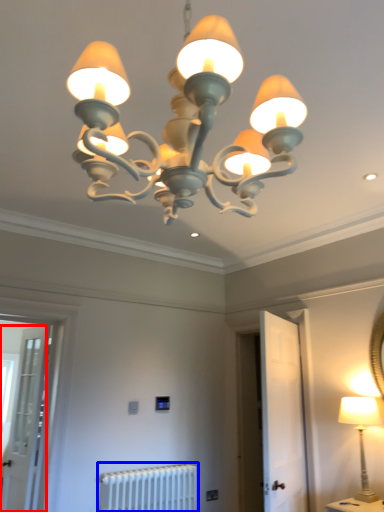
Question: Which object appears closest to the camera in this image, screen door (highlighted by a red box) or radiator (highlighted by a blue box)?

Choices:
 (A) screen door
 (B) radiator

Answer: (B)